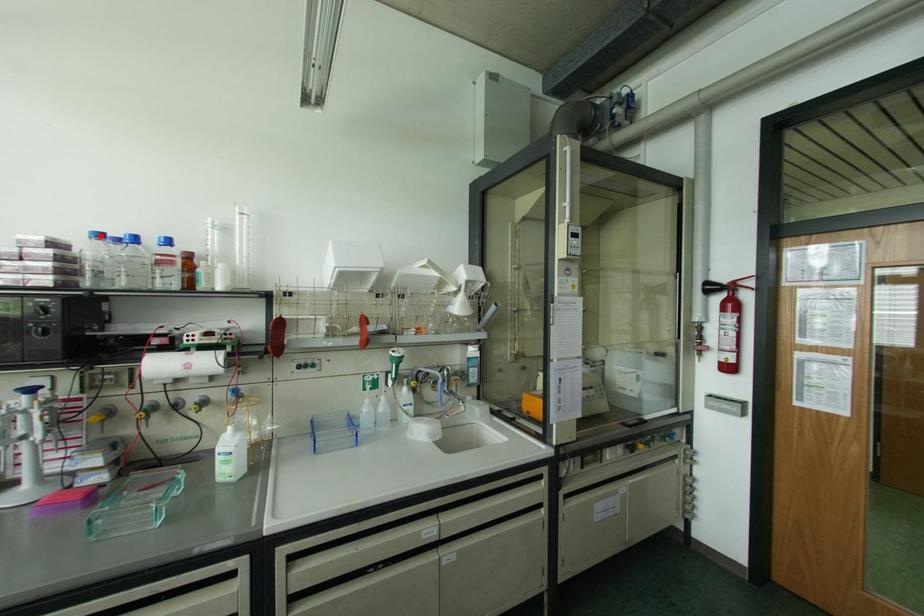
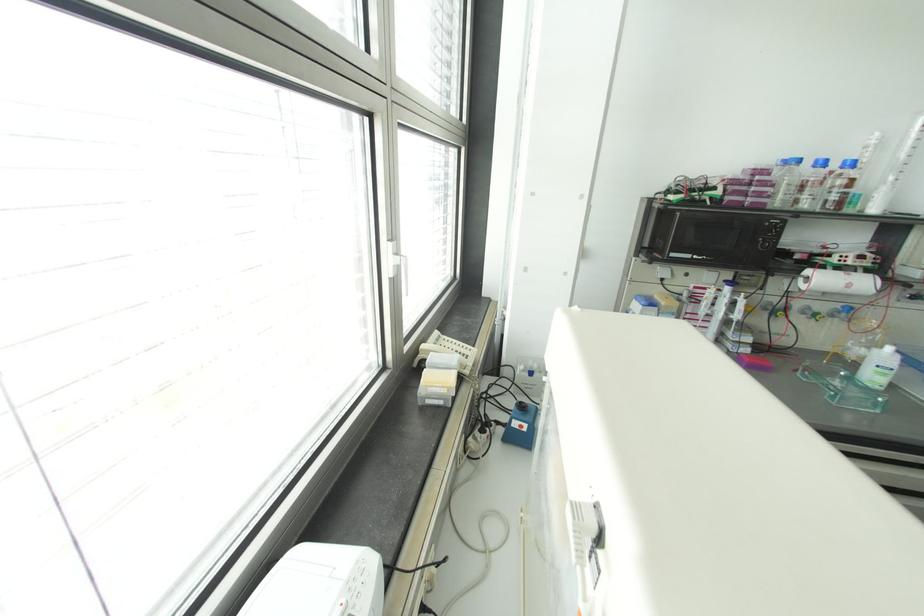
Where in the second image is the point corresponding to the highlighted location from the first image?

(797, 160)